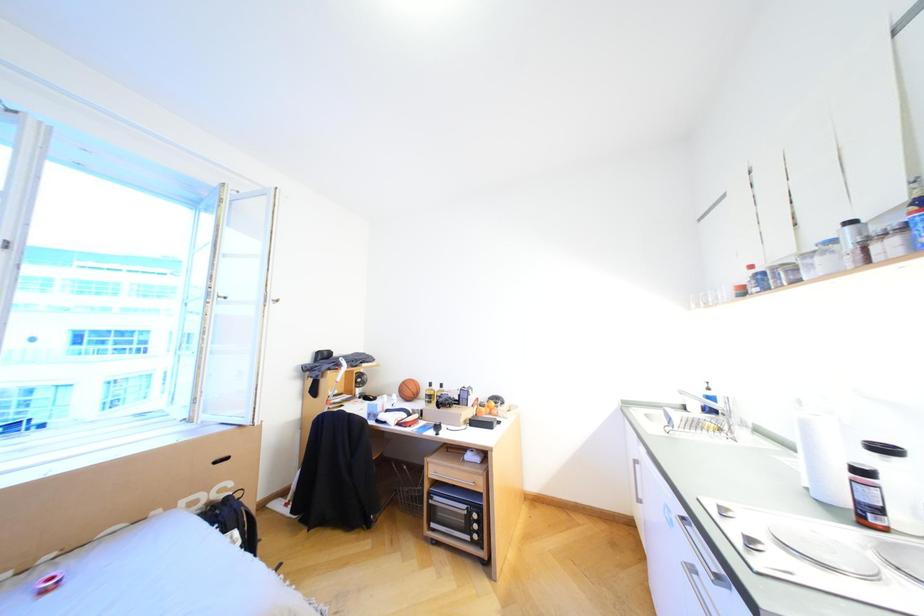
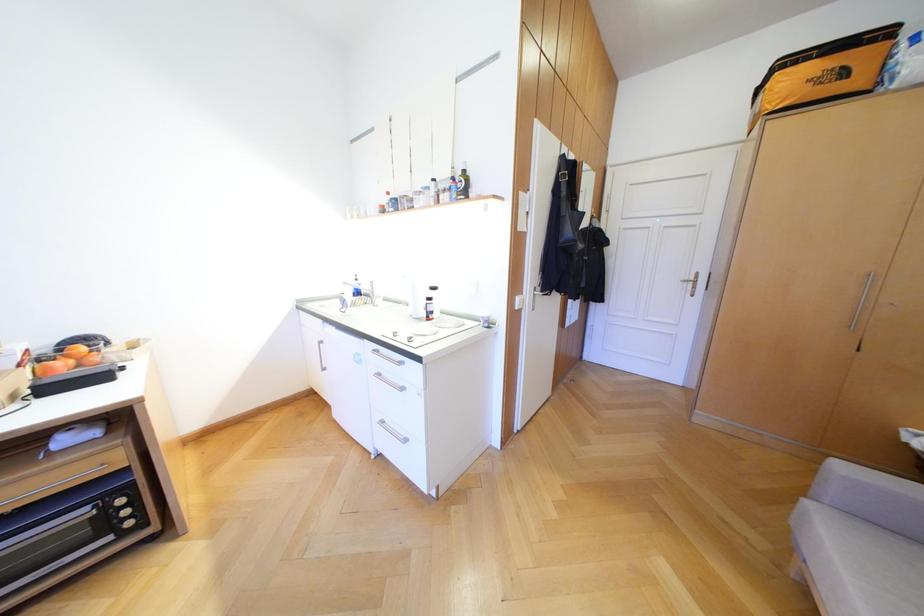
Question: The images are taken continuously from a first-person perspective. In which direction is your viewpoint rotating?

Choices:
 (A) Left
 (B) Right
 (C) Up
 (D) Down

Answer: (B)